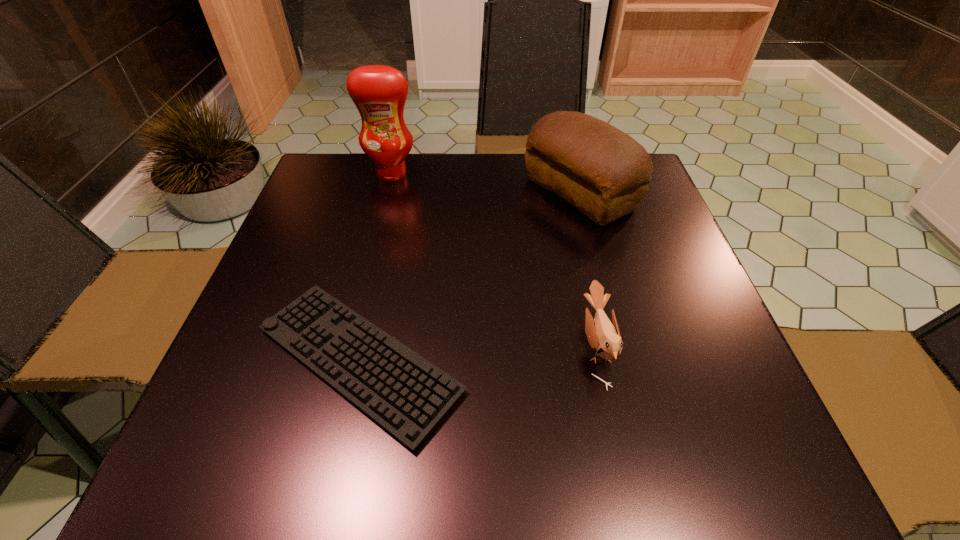
Where is `blank region between the third tallest object and the tallest object`? The height and width of the screenshot is (540, 960). blank region between the third tallest object and the tallest object is located at coordinates (494, 259).

Locate an element on the screen. free space between the second tallest object and the bird is located at coordinates (588, 269).

You are a GUI agent. You are given a task and a screenshot of the screen. Output one action in this format:
    pyautogui.click(x=<x>, y=<y>)
    Task: Click on the free space between the third tallest object and the tallest object
    The width and height of the screenshot is (960, 540).
    Given the screenshot: What is the action you would take?
    (x=494, y=259)

Locate which object ranks third in proximity to the third shortest object. Please provide its 2D coordinates. Your answer should be formatted as a tuple, i.e. [(x, y)], where the tuple contains the x and y coordinates of a point satisfying the conditions above.

[(379, 92)]

Identify the location of object that is the third nearest to the bread. (379, 92).

What are the coordinates of `vacant region that satisfies the following two spatial constraints: 1. on the label side of the computer keyboard; 2. on the left side of the tallest object` in the screenshot? It's located at (345, 360).

Find the location of a particular element. Image resolution: width=960 pixels, height=540 pixels. free space that satisfies the following two spatial constraints: 1. on the back side of the third shortest object; 2. on the right side of the shortest object is located at coordinates (396, 193).